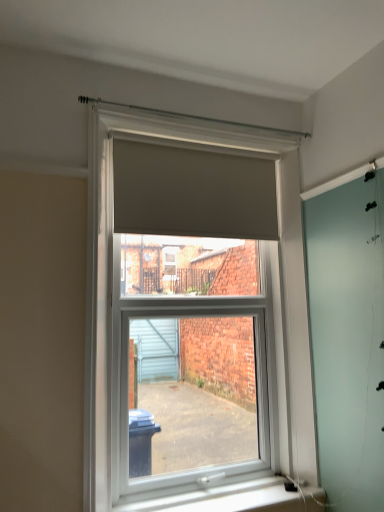
Question: From a real-world perspective, relative to white plastic window sill at lower center, is matte gray roller blind at center vertically above or below?

Choices:
 (A) above
 (B) below

Answer: (A)

Question: Is matte gray roller blind at center to the left or to the right of white plastic window sill at lower center in the image?

Choices:
 (A) right
 (B) left

Answer: (B)

Question: Which object is the farthest from the matte gray blind at upper center?

Choices:
 (A) matte gray roller blind at center
 (B) white plastic window sill at lower center

Answer: (B)

Question: Estimate the real-world distances between objects in this image. Which object is farther from the matte gray roller blind at center?

Choices:
 (A) white plastic window sill at lower center
 (B) matte gray blind at upper center

Answer: (A)